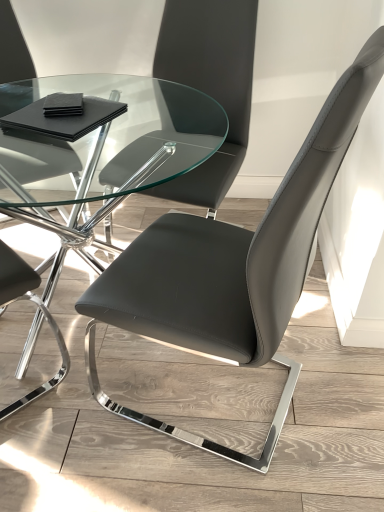
Image resolution: width=384 pixels, height=512 pixels. I want to click on transparent glass table at center, so click(x=101, y=155).

Find the location of a particular element. matte black chair at center, placed as the 2th chair when sorted from top to bottom is located at coordinates (232, 267).

How many degrees apart are the facing directions of transparent glass table at center and matte black chair at center, placed as the 2th chair when sorted from top to bottom?

The angle between the facing direction of transparent glass table at center and the facing direction of matte black chair at center, placed as the 2th chair when sorted from top to bottom, is 108 degrees.

Could you tell me if transparent glass table at center is facing matte black chair at center, placed as the 2th chair when sorted from top to bottom?

No.

Is transparent glass table at center taller or shorter than matte black chair at center, which is counted as the first chair, starting from the bottom?

Clearly, transparent glass table at center is shorter compared to matte black chair at center, which is counted as the first chair, starting from the bottom.

From the image's perspective, which one is positioned lower, transparent glass table at center or matte black chair at center, placed as the 2th chair when sorted from top to bottom?

matte black chair at center, placed as the 2th chair when sorted from top to bottom, is shown below in the image.

From a real-world perspective, is matte black chair at center, the first chair positioned from the top, physically located above or below transparent glass table at center?

matte black chair at center, the first chair positioned from the top, is situated higher than transparent glass table at center in the real world.

Relative to transparent glass table at center, is matte black chair at center, acting as the 2th chair starting from the bottom, in front or behind?

Visually, matte black chair at center, acting as the 2th chair starting from the bottom, is located behind transparent glass table at center.

Considering the points (200, 76) and (105, 102), which point is behind, point (200, 76) or point (105, 102)?

The point (200, 76) is more distant.

Could matte black chair at center, which is counted as the first chair, starting from the bottom, be considered to be inside matte black chair at center, the first chair positioned from the top?

No, matte black chair at center, the first chair positioned from the top, does not contain matte black chair at center, which is counted as the first chair, starting from the bottom.

Considering the sizes of objects matte black chair at center, acting as the 2th chair starting from the bottom, and matte black chair at center, placed as the 2th chair when sorted from top to bottom, in the image provided, who is thinner, matte black chair at center, acting as the 2th chair starting from the bottom, or matte black chair at center, placed as the 2th chair when sorted from top to bottom,?

Thinner between the two is matte black chair at center, acting as the 2th chair starting from the bottom.

Can you confirm if matte black chair at center, the first chair positioned from the top, is taller than matte black chair at center, placed as the 2th chair when sorted from top to bottom?

No.

Is matte black chair at center, placed as the 2th chair when sorted from top to bottom, positioned far away from transparent glass table at center?

No, matte black chair at center, placed as the 2th chair when sorted from top to bottom, is not far from transparent glass table at center.

Would you say transparent glass table at center is part of matte black chair at center, which is counted as the first chair, starting from the bottom,'s contents?

No, matte black chair at center, which is counted as the first chair, starting from the bottom, does not contain transparent glass table at center.

Does matte black chair at center, placed as the 2th chair when sorted from top to bottom, have a smaller size compared to matte black chair at center, acting as the 2th chair starting from the bottom?

Actually, matte black chair at center, placed as the 2th chair when sorted from top to bottom, might be larger than matte black chair at center, acting as the 2th chair starting from the bottom.

Which of these two, matte black chair at center, which is counted as the first chair, starting from the bottom, or matte black chair at center, acting as the 2th chair starting from the bottom, is wider?

matte black chair at center, which is counted as the first chair, starting from the bottom, is wider.

Which of these two, matte black chair at center, placed as the 2th chair when sorted from top to bottom, or matte black chair at center, the first chair positioned from the top, stands shorter?

Standing shorter between the two is matte black chair at center, the first chair positioned from the top.

Could you measure the distance between matte black chair at center, which is counted as the first chair, starting from the bottom, and matte black chair at center, acting as the 2th chair starting from the bottom?

matte black chair at center, which is counted as the first chair, starting from the bottom, is 55.69 centimeters from matte black chair at center, acting as the 2th chair starting from the bottom.

Considering the sizes of transparent glass table at center and matte black chair at center, the first chair positioned from the top, in the image, is transparent glass table at center wider or thinner than matte black chair at center, the first chair positioned from the top,?

Clearly, transparent glass table at center has more width compared to matte black chair at center, the first chair positioned from the top.

Are transparent glass table at center and matte black chair at center, acting as the 2th chair starting from the bottom, far apart?

No, transparent glass table at center is in close proximity to matte black chair at center, acting as the 2th chair starting from the bottom.

In terms of size, does transparent glass table at center appear bigger or smaller than matte black chair at center, the first chair positioned from the top?

Clearly, transparent glass table at center is larger in size than matte black chair at center, the first chair positioned from the top.

From a real-world perspective, is transparent glass table at center positioned above or below matte black chair at center, acting as the 2th chair starting from the bottom?

transparent glass table at center is situated lower than matte black chair at center, acting as the 2th chair starting from the bottom, in the real world.

In order to click on chair that is the 1st object above the transparent glass table at center (from a real-world perspective) in this screenshot , I will do `click(232, 267)`.

The image size is (384, 512). Identify the location of the 1st chair counting from the right side of the transparent glass table at center. (210, 84).

Based on their spatial positions, is matte black chair at center, which is counted as the first chair, starting from the bottom, or matte black chair at center, the first chair positioned from the top, further from transparent glass table at center?

Based on the image, matte black chair at center, which is counted as the first chair, starting from the bottom, appears to be further to transparent glass table at center.

Based on their spatial positions, is matte black chair at center, which is counted as the first chair, starting from the bottom, or transparent glass table at center closer to matte black chair at center, acting as the 2th chair starting from the bottom?

transparent glass table at center.

Looking at the image, which one is located closer to matte black chair at center, which is counted as the first chair, starting from the bottom, matte black chair at center, the first chair positioned from the top, or transparent glass table at center?

matte black chair at center, the first chair positioned from the top.

Which object lies nearer to the anchor point matte black chair at center, acting as the 2th chair starting from the bottom, transparent glass table at center or matte black chair at center, placed as the 2th chair when sorted from top to bottom?

Among the two, transparent glass table at center is located nearer to matte black chair at center, acting as the 2th chair starting from the bottom.

Considering their positions, is transparent glass table at center positioned further to matte black chair at center, placed as the 2th chair when sorted from top to bottom, than matte black chair at center, the first chair positioned from the top?

Based on the image, transparent glass table at center appears to be further to matte black chair at center, placed as the 2th chair when sorted from top to bottom.

Considering their positions, is matte black chair at center, the first chair positioned from the top, positioned further to transparent glass table at center than matte black chair at center, which is counted as the first chair, starting from the bottom?

matte black chair at center, which is counted as the first chair, starting from the bottom, is positioned further to the anchor transparent glass table at center.

The height and width of the screenshot is (512, 384). I want to click on table between matte black chair at center, acting as the 2th chair starting from the bottom, and matte black chair at center, placed as the 2th chair when sorted from top to bottom, in the vertical direction, so click(101, 155).